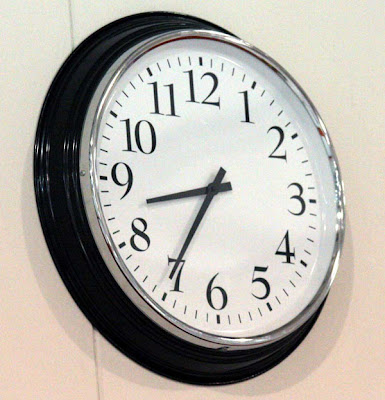
This screenshot has width=385, height=400. I want to click on clock, so click(227, 201).